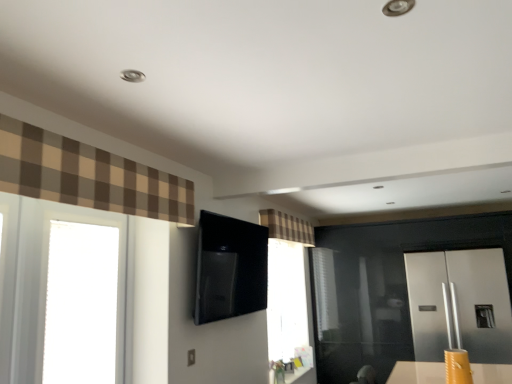
Question: Should I look upward or downward to see transparent glass window at left?

Choices:
 (A) up
 (B) down

Answer: (B)

Question: From the image's perspective, does satin silver refrigerator at right appear lower than transparent glass window at left?

Choices:
 (A) no
 (B) yes

Answer: (B)

Question: Is satin silver refrigerator at right closer to the viewer compared to transparent glass window at left?

Choices:
 (A) no
 (B) yes

Answer: (A)

Question: Can you confirm if satin silver refrigerator at right is bigger than transparent glass window at left?

Choices:
 (A) no
 (B) yes

Answer: (B)

Question: Considering the relative sizes of satin silver refrigerator at right and transparent glass window at left in the image provided, is satin silver refrigerator at right wider than transparent glass window at left?

Choices:
 (A) no
 (B) yes

Answer: (B)

Question: Can you confirm if satin silver refrigerator at right is thinner than transparent glass window at left?

Choices:
 (A) yes
 (B) no

Answer: (B)

Question: Is satin silver refrigerator at right surrounding transparent glass window at left?

Choices:
 (A) yes
 (B) no

Answer: (B)

Question: Is matte black outlet at lower center located outside satin silver refrigerator at right?

Choices:
 (A) no
 (B) yes

Answer: (B)

Question: From a real-world perspective, is matte black outlet at lower center over satin silver refrigerator at right?

Choices:
 (A) yes
 (B) no

Answer: (B)

Question: Is the depth of matte black outlet at lower center less than that of satin silver refrigerator at right?

Choices:
 (A) yes
 (B) no

Answer: (A)

Question: Is matte black outlet at lower center turned away from satin silver refrigerator at right?

Choices:
 (A) yes
 (B) no

Answer: (B)

Question: Can you confirm if matte black outlet at lower center is positioned to the left of satin silver refrigerator at right?

Choices:
 (A) yes
 (B) no

Answer: (A)

Question: Is matte black outlet at lower center far from satin silver refrigerator at right?

Choices:
 (A) no
 (B) yes

Answer: (B)

Question: Is plaid fabric curtain at upper center, placed as the first curtain when sorted from bottom to top, at the back of matte black outlet at lower center?

Choices:
 (A) yes
 (B) no

Answer: (B)